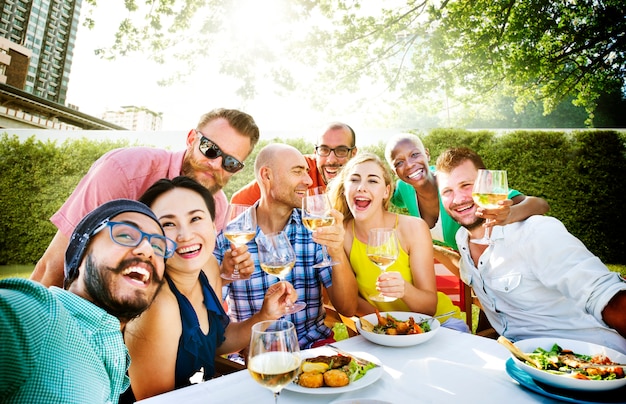
Locate an element on the screen. wine glass is located at coordinates (250, 226), (275, 258), (324, 213), (390, 249), (484, 192), (279, 350).